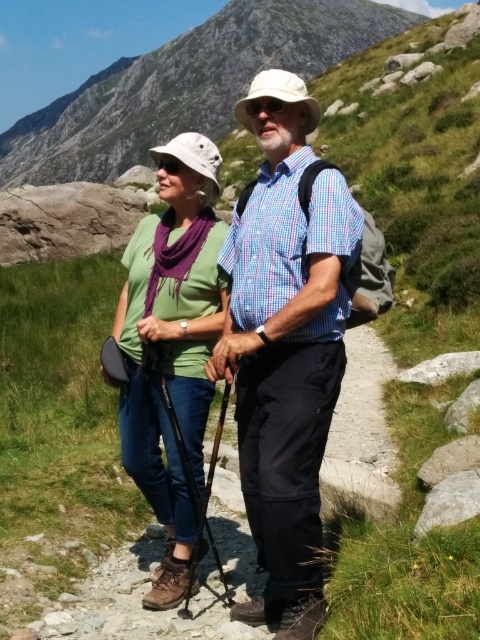
Does matte blue shirt at center have a lesser height compared to granite rock at upper center?

Yes, matte blue shirt at center is shorter than granite rock at upper center.

Does point (308, 381) come behind point (166, 68)?

No, it is not.

Identify the location of matte blue shirt at center. (286, 342).

Who is positioned more to the right, matte blue shirt at center or green matte shirt at center?

matte blue shirt at center

Is matte blue shirt at center to the right of green matte shirt at center from the viewer's perspective?

Correct, you'll find matte blue shirt at center to the right of green matte shirt at center.

I want to click on matte blue shirt at center, so click(286, 342).

Find the location of a particular element. The image size is (480, 640). matte blue shirt at center is located at coordinates (286, 342).

You are a GUI agent. You are given a task and a screenshot of the screen. Output one action in this format:
    pyautogui.click(x=<x>, y=<y>)
    Task: Click on the granite rock at upper center
    
    Given the screenshot: What is the action you would take?
    pyautogui.click(x=187, y=84)

Measure the distance between granite rock at upper center and camera.

granite rock at upper center and camera are 562.71 feet apart from each other.

The image size is (480, 640). What are the coordinates of `granite rock at upper center` in the screenshot? It's located at (187, 84).